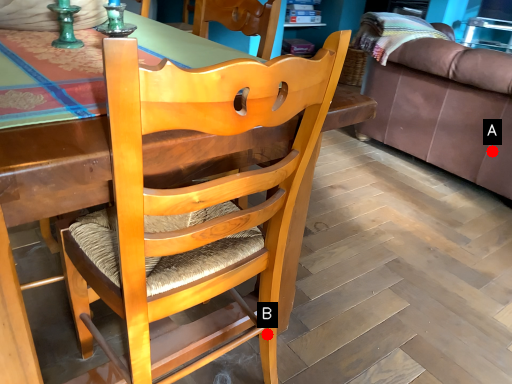
Question: Two points are circled on the image, labeled by A and B beside each circle. Among these points, which one is farthest from the camera?

Choices:
 (A) A is further
 (B) B is further

Answer: (A)